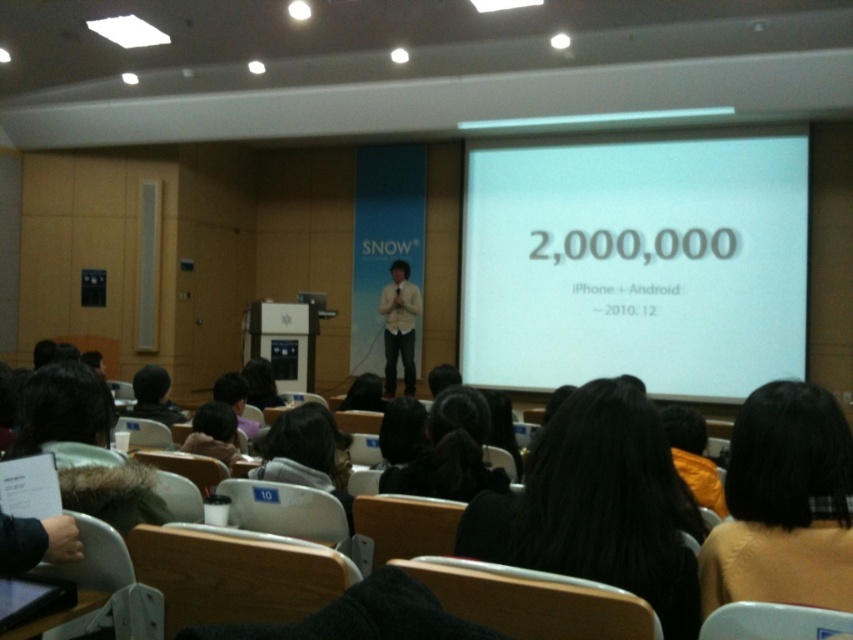
You are an attendee in the lecture hall and want to see the presentation slides clearly. Where should you sit to have the best view of the white matte projection screen at center?

You should sit in the center of the lecture hall to have the best view of the white matte projection screen at center, as it is positioned at the center of the room.

From the picture: In the lecture hall scene, there is a point marked at coordinates (636, 262). What object is located at this point?

The white matte projection screen at center is located at the point marked by coordinates (636, 262).